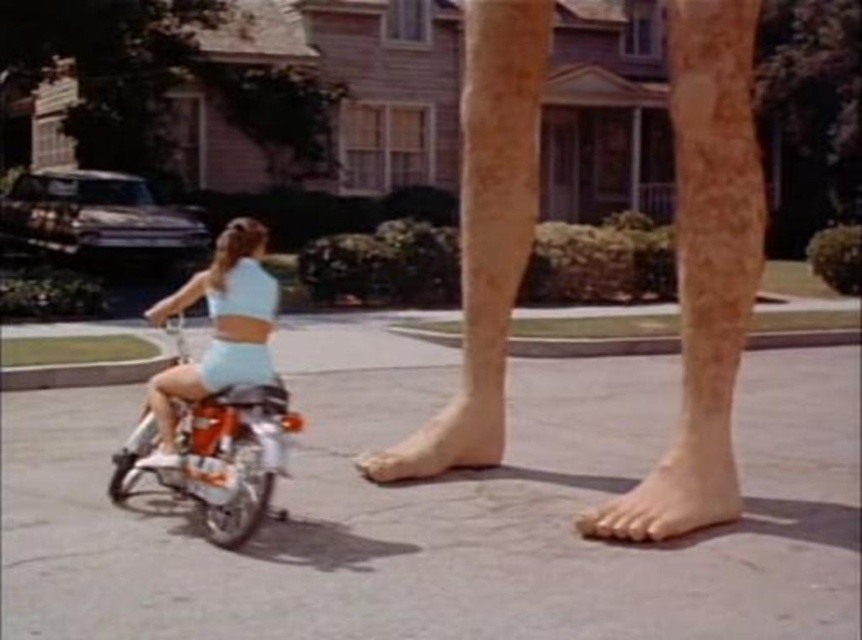
Question: Which point is farther to the camera?

Choices:
 (A) (166, 385)
 (B) (253, 484)
 (C) (498, 438)

Answer: (C)

Question: Which point is farther from the camera taking this photo?

Choices:
 (A) (245, 337)
 (B) (416, 476)
 (C) (729, 451)

Answer: (B)

Question: Can you confirm if orange metallic motorcycle at lower left is positioned below skinny barefoot at lower center?

Choices:
 (A) yes
 (B) no

Answer: (A)

Question: Is the position of light blue fabric shorts at lower left more distant than that of skinny barefoot at lower center?

Choices:
 (A) yes
 (B) no

Answer: (B)

Question: Is orange metallic motorcycle at lower left thinner than smooth skin foot at lower right?

Choices:
 (A) no
 (B) yes

Answer: (A)

Question: Which of the following is the closest to the observer?

Choices:
 (A) light blue fabric shorts at lower left
 (B) smooth skin foot at lower right
 (C) skinny barefoot at lower center
 (D) orange metallic motorcycle at lower left

Answer: (D)